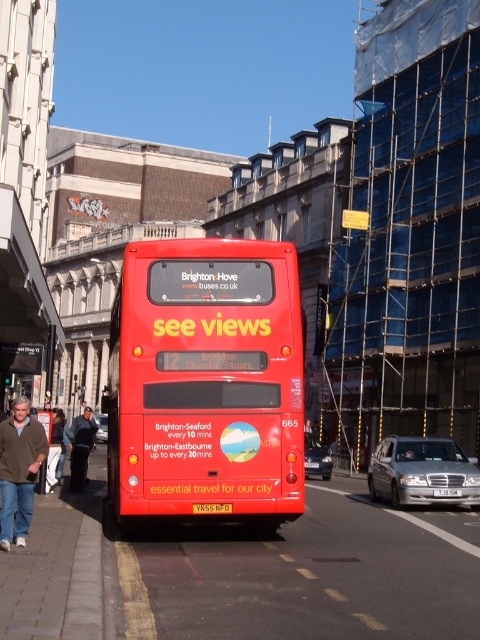
You are a photographer planning to capture the matte red bus at center and the silver metallic car at center in a single frame. Based on their heights, which vehicle should you position closer to the camera to ensure both are fully visible without cropping?

Since the matte red bus at center is not as tall as the silver metallic car at center, you should position the matte red bus at center closer to the camera. This adjustment will help balance their sizes in the frame, ensuring both vehicles are fully visible without cropping.

You are a delivery person who needs to attach a parcel to the matte red bus at center. The parcel requires a minimum distance of 6 feet from the yellow matte license plate at center to avoid blocking it. Based on the scene, will the parcel placement be feasible?

The matte red bus at center is only 5.82 feet away from the yellow matte license plate at center, which is less than the required 6 feet. Therefore, attaching the parcel at this location would block the license plate, making it infeasible.